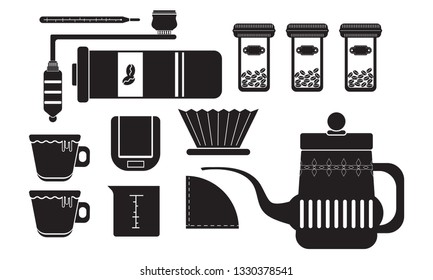
I want to click on coffee pot spout, so click(203, 168), click(226, 169), click(254, 183), click(267, 201).